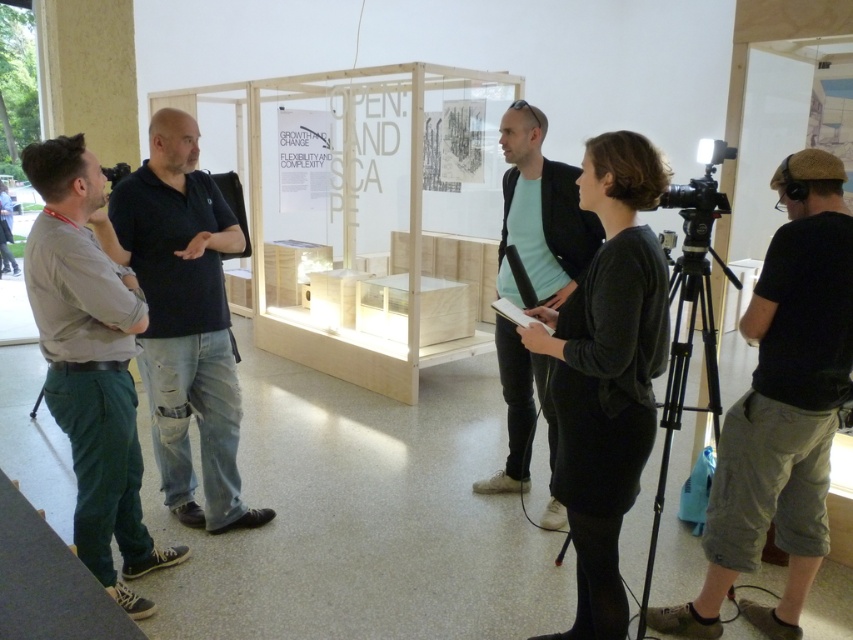
Based on the photo, you are a photographer standing in the exhibition space. You want to take a photo of the dark blue shirt at center and the green cotton pants at left. Which one should you focus on if you want to capture the larger object in your frame?

The dark blue shirt at center is bigger than the green cotton pants at left, so you should focus on the dark blue shirt at center to capture the larger object in your frame.

You are standing in the exhibition space and want to see the person wearing the green cotton pants at left. However, the dark blue shirt at center is blocking your view. Can you move around to see them?

The green cotton pants at left is behind the dark blue shirt at center, so moving around to the side or behind the dark blue shirt at center might allow you to see the green cotton pants at left.